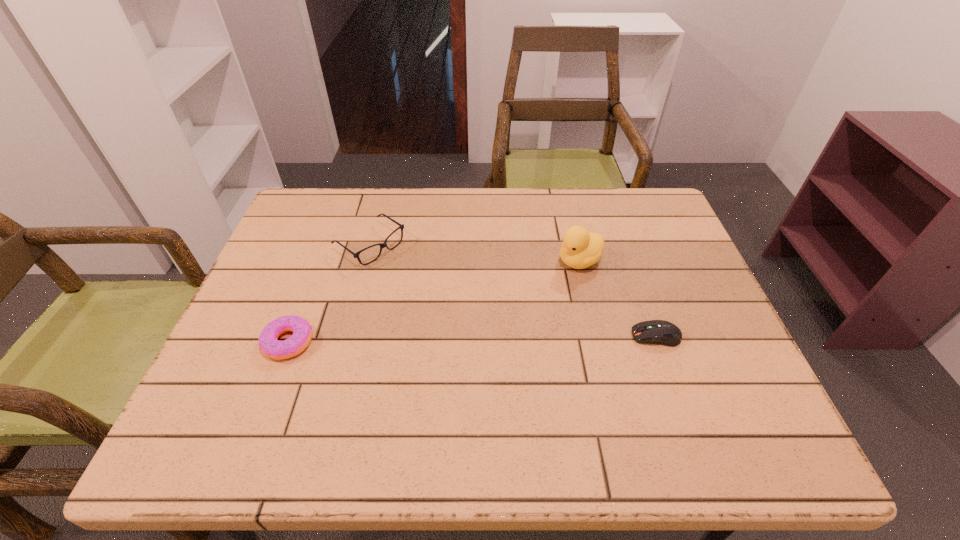
In order to click on vacant space on the desktop that is between the doughnut and the computer equipment and is positioned on the front-facing side of the spectacles in this screenshot , I will do `click(504, 339)`.

This screenshot has width=960, height=540. What are the coordinates of `vacant space on the desktop that is between the doughnut and the rightmost object and is positioned on the front-facing side of the tallest object` in the screenshot? It's located at (434, 340).